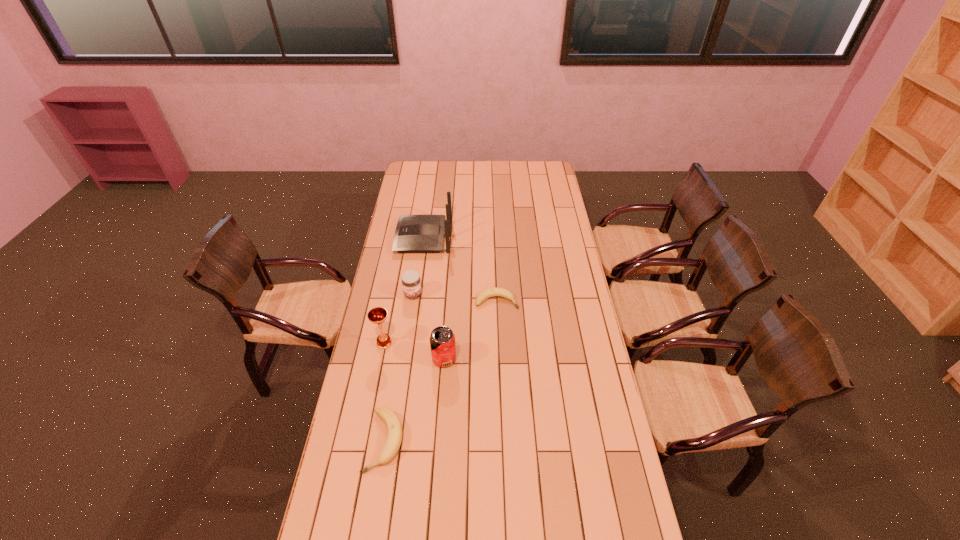
What are the coordinates of `blank region between the tallest object and the soda can` in the screenshot? It's located at (434, 298).

I want to click on vacant point located between the jam and the chalice, so click(398, 319).

Locate an element on the screen. free space between the jam and the fourth shortest object is located at coordinates (428, 327).

In order to click on unoccupied position between the chalice and the rightmost object in this screenshot , I will do `click(441, 322)`.

The width and height of the screenshot is (960, 540). In order to click on empty space that is in between the soda can and the second shortest object in this screenshot , I will do `click(415, 400)`.

Where is `object that stands as the third closest to the taller banana`? object that stands as the third closest to the taller banana is located at coordinates (411, 282).

Locate an element on the screen. the second closest object to the taller banana is located at coordinates (377, 315).

Find the location of `vacant space that satisfies the following two spatial constraints: 1. on the front-facing side of the router; 2. at the stem of the fifth tallest object`. vacant space that satisfies the following two spatial constraints: 1. on the front-facing side of the router; 2. at the stem of the fifth tallest object is located at coordinates (395, 441).

The image size is (960, 540). I want to click on vacant space that satisfies the following two spatial constraints: 1. on the front label of the jam; 2. on the right side of the soda can, so click(403, 359).

I want to click on vacant position in the image that satisfies the following two spatial constraints: 1. on the front-facing side of the tallest object; 2. at the stem of the taller banana, so click(x=395, y=441).